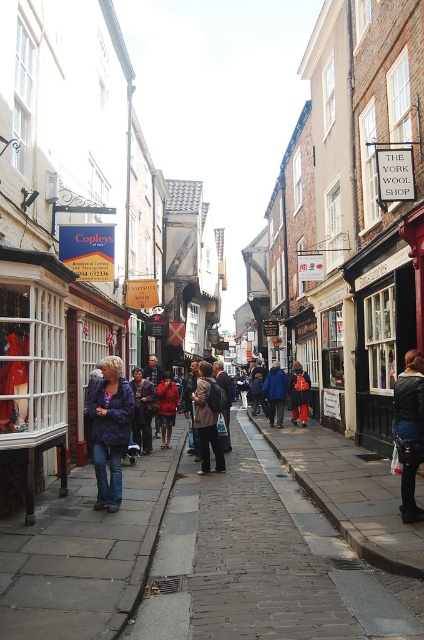
Question: Which of the following is the farthest from the observer?

Choices:
 (A) (407, 448)
 (B) (267, 554)

Answer: (A)

Question: Which object is farther from the camera taking this photo?

Choices:
 (A) dark gray jacket at center
 (B) leather jacket at center

Answer: (A)

Question: Which point is closer to the camera taking this photo?

Choices:
 (A) (200, 416)
 (B) (278, 538)
 (C) (293, 404)
 (D) (170, 445)

Answer: (B)

Question: Is denim jacket at left bigger than blue wool coat at center?

Choices:
 (A) yes
 (B) no

Answer: (B)

Question: Can you confirm if dark gray jacket at center is positioned above dark blue jacket at center?

Choices:
 (A) no
 (B) yes

Answer: (B)

Question: Is red wool coat at center further to camera compared to dark blue jacket at center?

Choices:
 (A) yes
 (B) no

Answer: (B)